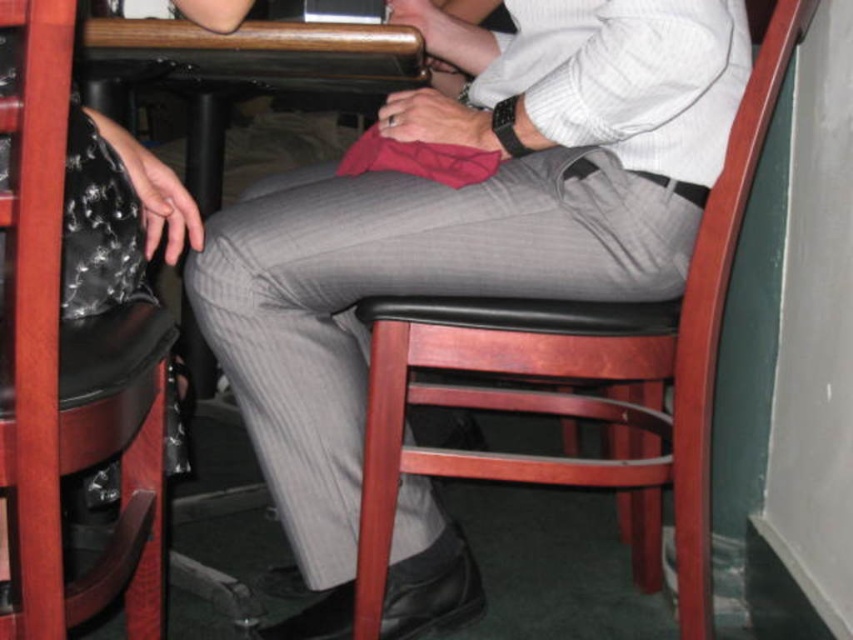
The height and width of the screenshot is (640, 853). What do you see at coordinates (74, 387) in the screenshot?
I see `black leather chair at center` at bounding box center [74, 387].

Between black leather chair at center and wooden table at center, which one appears on the right side from the viewer's perspective?

wooden table at center is more to the right.

Is point (123, 333) positioned behind point (397, 33)?

No, it is in front of (397, 33).

Identify the location of black leather chair at center. (74, 387).

Can you confirm if wooden chair at center is smaller than black leather chair at center?

Incorrect, wooden chair at center is not smaller in size than black leather chair at center.

Is point (653, 433) less distant than point (61, 52)?

No, it is not.

This screenshot has height=640, width=853. Identify the location of wooden chair at center. (579, 376).

You are a GUI agent. You are given a task and a screenshot of the screen. Output one action in this format:
    pyautogui.click(x=<x>, y=<y>)
    Task: Click on the wooden chair at center
    The height and width of the screenshot is (640, 853).
    Given the screenshot: What is the action you would take?
    pyautogui.click(x=579, y=376)

Between wooden chair at center and wooden table at center, which one appears on the left side from the viewer's perspective?

wooden table at center

Does point (618, 339) lie in front of point (126, 44)?

Yes.

Identify the location of wooden chair at center. (579, 376).